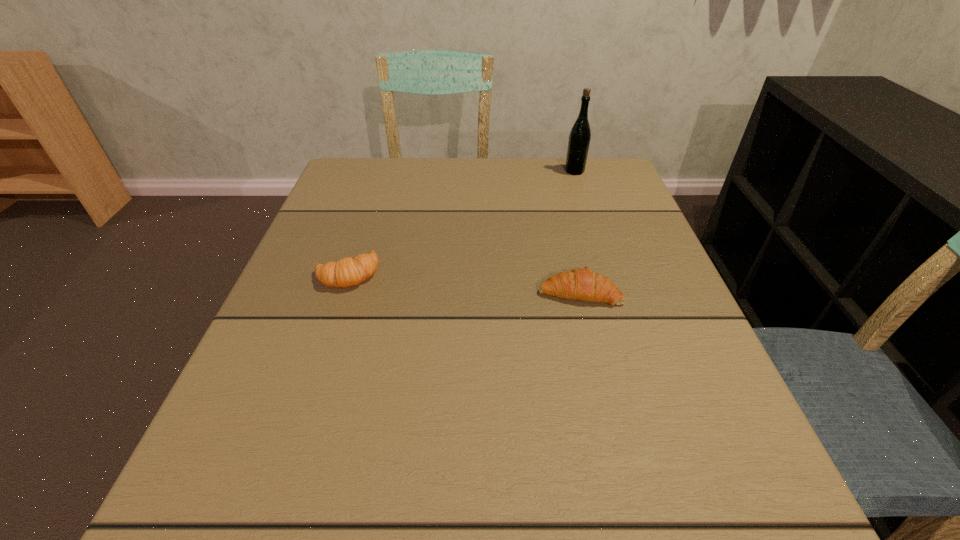
The image size is (960, 540). I want to click on vacant point that satisfies the following two spatial constraints: 1. on the back side of the farthest object; 2. on the left side of the right crescent roll, so click(550, 171).

What are the coordinates of `free space that satisfies the following two spatial constraints: 1. on the back side of the right crescent roll; 2. on the left side of the tallest object` in the screenshot? It's located at (550, 171).

The image size is (960, 540). Find the location of `free location that satisfies the following two spatial constraints: 1. on the front side of the right crescent roll; 2. on the right side of the leftmost object`. free location that satisfies the following two spatial constraints: 1. on the front side of the right crescent roll; 2. on the right side of the leftmost object is located at coordinates (342, 292).

Where is `free space in the image that satisfies the following two spatial constraints: 1. on the back side of the leftmost object; 2. on the right side of the beer bottle`? The width and height of the screenshot is (960, 540). free space in the image that satisfies the following two spatial constraints: 1. on the back side of the leftmost object; 2. on the right side of the beer bottle is located at coordinates (382, 171).